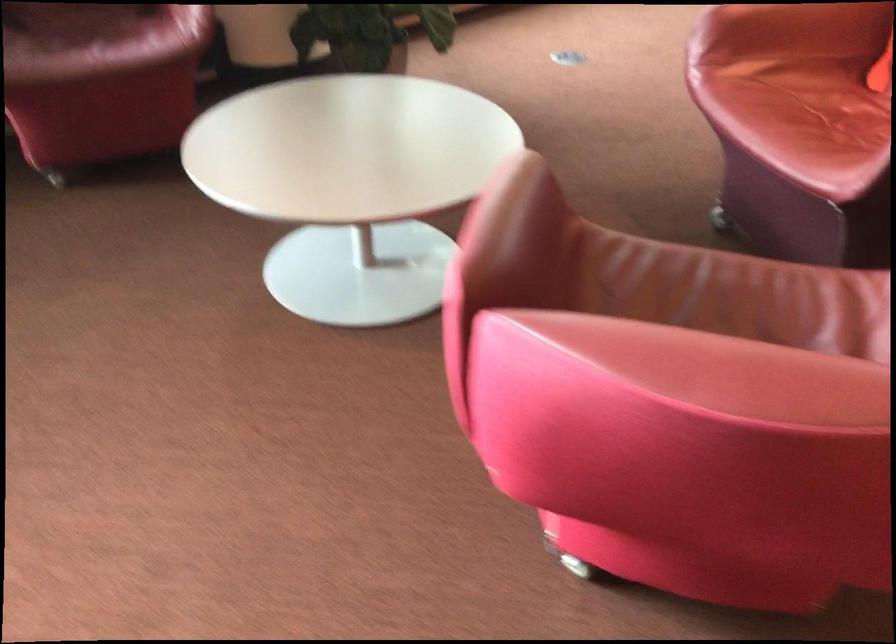
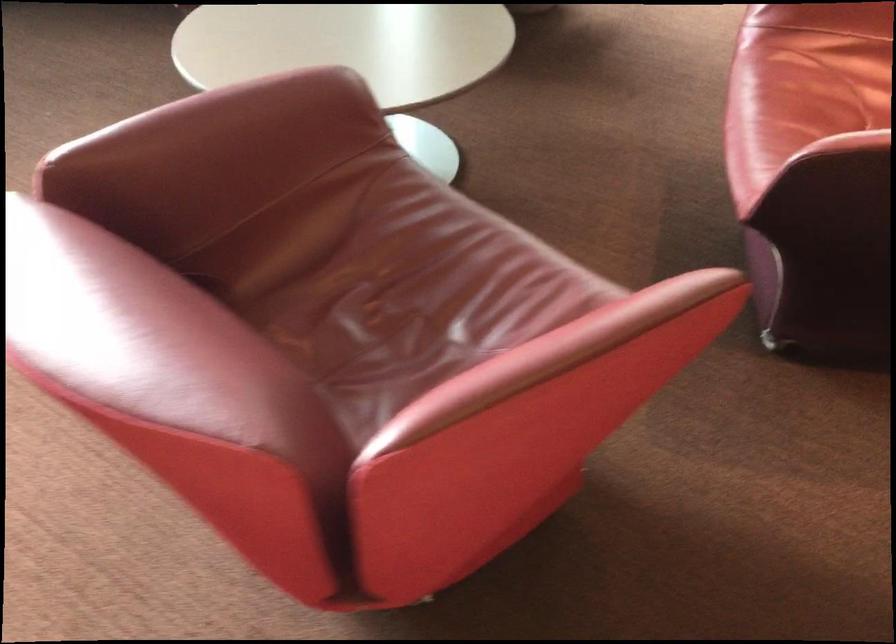
In the second image, find the point that corresponds to [688,319] in the first image.

(392, 287)